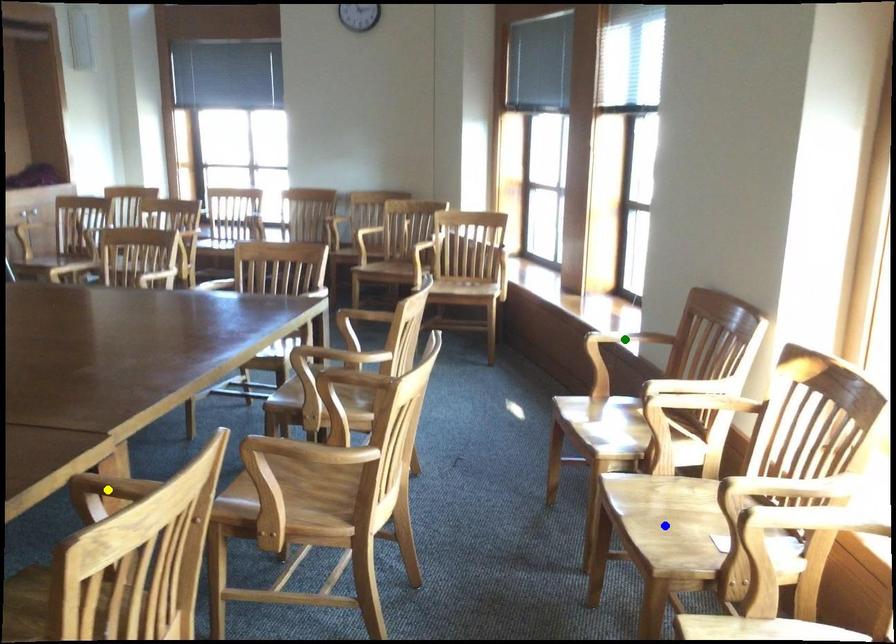
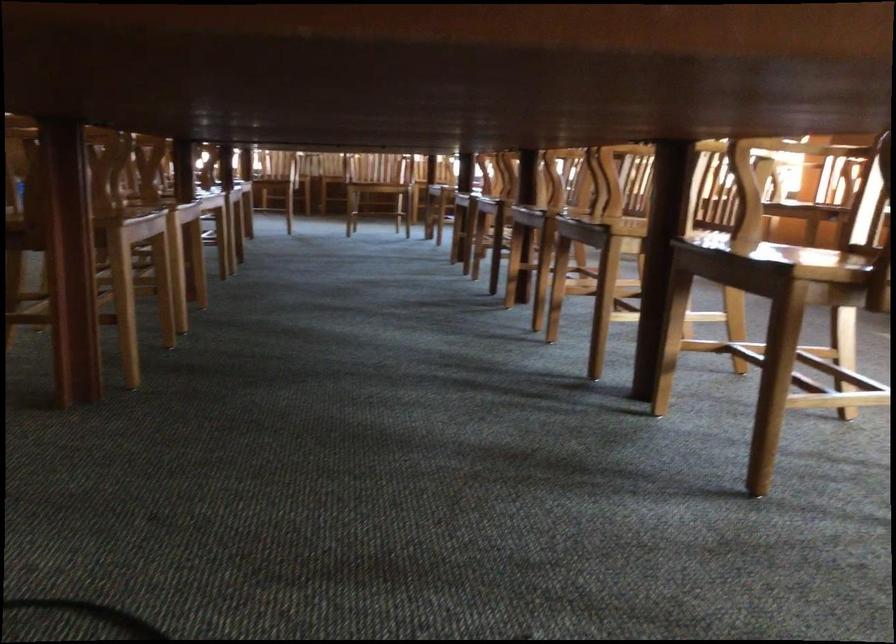
I am providing you with two images of the same scene from different viewpoints. Three points are marked in image1. Which point corresponds to a part or object that is occluded in image2?In image1, three points are marked. Which of them correspond to a part or object that is occluded in image2?Among the three points shown in image1, which one corresponds to a part or object that is no longer visible due to occlusion in image2?

yellow point, green point, blue point